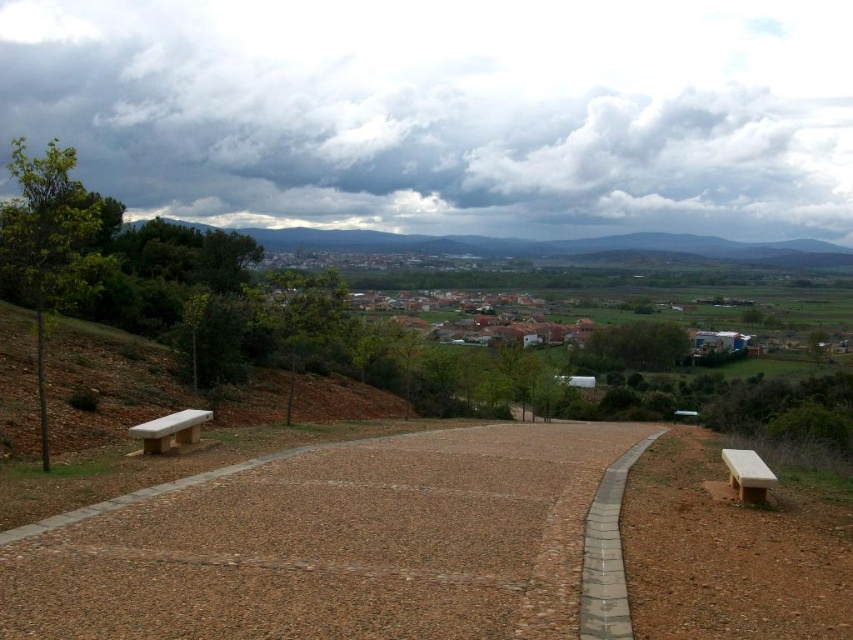
Question: Can you confirm if green grassy hillside at center is positioned above light brown wooden bench at right?

Choices:
 (A) no
 (B) yes

Answer: (B)

Question: Among these points, which one is farthest from the camera?

Choices:
 (A) (502, 529)
 (B) (608, 500)

Answer: (B)

Question: Can you confirm if gray concrete path at center is thinner than light brown wooden bench at right?

Choices:
 (A) yes
 (B) no

Answer: (B)

Question: Considering the real-world distances, which object is closest to the brown gravel path at center?

Choices:
 (A) white polished wood bench at lower left
 (B) light brown wooden bench at right
 (C) green grassy hillside at center
 (D) gray concrete path at center

Answer: (D)

Question: Does brown gravel path at center have a larger size compared to white polished wood bench at lower left?

Choices:
 (A) yes
 (B) no

Answer: (A)

Question: Considering the real-world distances, which object is farthest from the white polished wood bench at lower left?

Choices:
 (A) light brown wooden bench at right
 (B) gray concrete path at center
 (C) brown gravel path at center

Answer: (A)